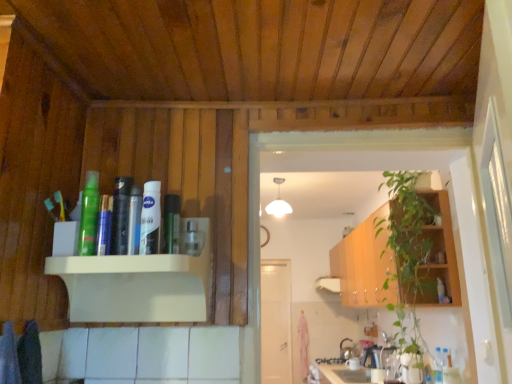
Question: Is white matte door at center at the right side of white glossy nivea cream at upper center, which ranks as the 2th toiletry in left-to-right order?

Choices:
 (A) no
 (B) yes

Answer: (B)

Question: Is white matte door at center facing towards white glossy nivea cream at upper center, which ranks as the 2th toiletry in left-to-right order?

Choices:
 (A) no
 (B) yes

Answer: (B)

Question: From the image's perspective, is white matte door at center located beneath white glossy nivea cream at upper center, which ranks as the 2th toiletry in left-to-right order?

Choices:
 (A) yes
 (B) no

Answer: (A)

Question: Is white matte door at center next to white glossy nivea cream at upper center, acting as the 2th toiletry starting from the right, and touching it?

Choices:
 (A) yes
 (B) no

Answer: (B)

Question: Are white matte door at center and white glossy nivea cream at upper center, which ranks as the 2th toiletry in left-to-right order, located far from each other?

Choices:
 (A) yes
 (B) no

Answer: (A)

Question: From the image's perspective, is green leafy plant at right located above or below white glossy nivea cream at upper center, acting as the 2th toiletry starting from the right?

Choices:
 (A) above
 (B) below

Answer: (B)

Question: Looking at the image, does green leafy plant at right seem bigger or smaller compared to white glossy nivea cream at upper center, acting as the 2th toiletry starting from the right?

Choices:
 (A) small
 (B) big

Answer: (B)

Question: Relative to white glossy nivea cream at upper center, which ranks as the 2th toiletry in left-to-right order, is green leafy plant at right in front or behind?

Choices:
 (A) front
 (B) behind

Answer: (B)

Question: Is green leafy plant at right taller or shorter than white glossy nivea cream at upper center, which ranks as the 2th toiletry in left-to-right order?

Choices:
 (A) short
 (B) tall

Answer: (B)

Question: From the image's perspective, is clear plastic bottle at center located above or below white matte door at center?

Choices:
 (A) above
 (B) below

Answer: (A)

Question: Does point (184, 251) appear closer or farther from the camera than point (268, 370)?

Choices:
 (A) farther
 (B) closer

Answer: (B)

Question: Considering the positions of clear plastic bottle at center and white matte door at center in the image, is clear plastic bottle at center taller or shorter than white matte door at center?

Choices:
 (A) short
 (B) tall

Answer: (A)

Question: Visually, is clear plastic bottle at center positioned to the left or to the right of white matte door at center?

Choices:
 (A) right
 (B) left

Answer: (B)

Question: From the image's perspective, is white matte door at center positioned above or below green leafy plant at right?

Choices:
 (A) above
 (B) below

Answer: (B)

Question: From a real-world perspective, relative to green leafy plant at right, is white matte door at center vertically above or below?

Choices:
 (A) above
 (B) below

Answer: (B)